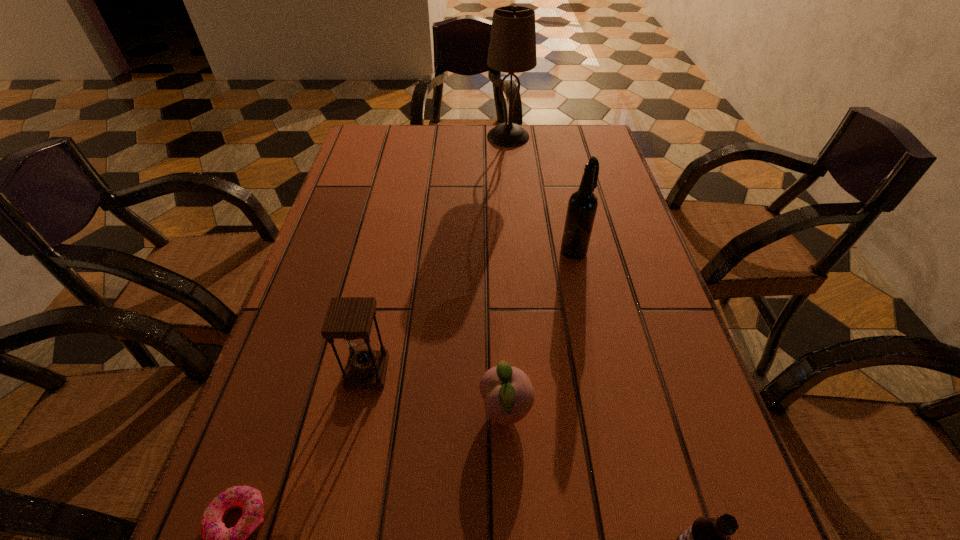
Where is `lampshade`? This screenshot has width=960, height=540. lampshade is located at coordinates (512, 48).

You are a GUI agent. You are given a task and a screenshot of the screen. Output one action in this format:
    pyautogui.click(x=<x>, y=<y>)
    Task: Click on the tallest object
    This screenshot has width=960, height=540.
    Given the screenshot: What is the action you would take?
    pyautogui.click(x=512, y=48)

You are a GUI agent. You are given a task and a screenshot of the screen. Output one action in this format:
    pyautogui.click(x=<x>, y=<y>)
    Task: Click on the fifth object from left to right
    The height and width of the screenshot is (540, 960).
    Given the screenshot: What is the action you would take?
    pyautogui.click(x=582, y=206)

Find the location of a particular element. The height and width of the screenshot is (540, 960). the second tallest object is located at coordinates (582, 206).

Where is `hourglass`? This screenshot has height=540, width=960. hourglass is located at coordinates (348, 318).

Locate an element on the screen. The height and width of the screenshot is (540, 960). peach is located at coordinates (507, 391).

You are a GUI agent. You are given a task and a screenshot of the screen. Output one action in this format:
    pyautogui.click(x=<x>, y=<y>)
    Task: Click on the vacant region located 0.350m on the front-facing side of the lampshade
    
    Given the screenshot: What is the action you would take?
    pyautogui.click(x=376, y=137)

You are a GUI agent. You are given a task and a screenshot of the screen. Output one action in this format:
    pyautogui.click(x=<x>, y=<y>)
    Task: Click on the vacant region located 0.230m on the front-facing side of the lampshade
    The height and width of the screenshot is (540, 960).
    Given the screenshot: What is the action you would take?
    pyautogui.click(x=414, y=137)

This screenshot has width=960, height=540. Identify the location of vacant position located 0.150m on the front-facing side of the lampshade. (439, 137).

The image size is (960, 540). I want to click on free spot located on the front of the second object from right to left, so click(610, 416).